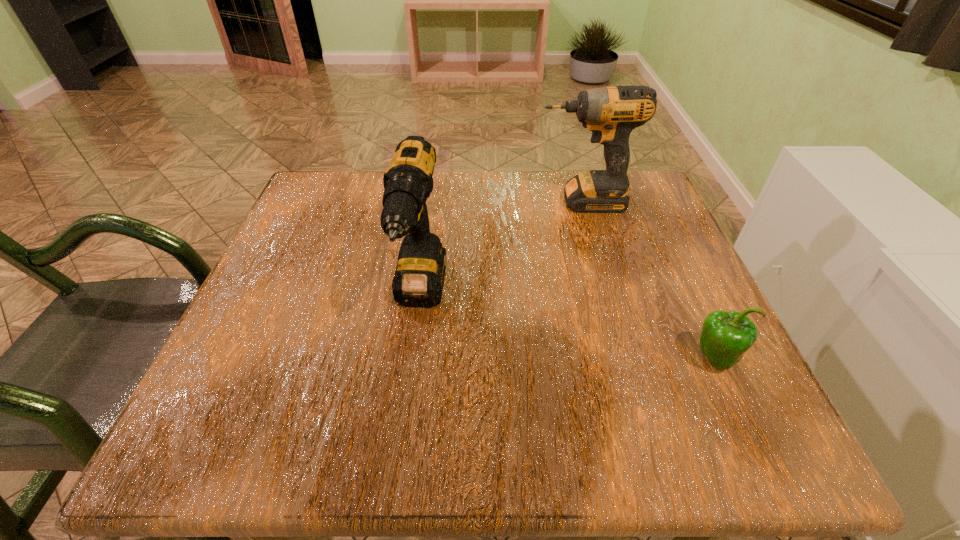
The image size is (960, 540). What are the coordinates of `the nearer drill` in the screenshot? It's located at (418, 281).

Image resolution: width=960 pixels, height=540 pixels. Find the location of `the leftmost object`. the leftmost object is located at coordinates coord(418,281).

I want to click on the right drill, so click(x=611, y=113).

This screenshot has height=540, width=960. Identify the location of the farther drill. (611, 113).

The height and width of the screenshot is (540, 960). In order to click on bell pepper in this screenshot , I will do `click(725, 336)`.

In order to click on free space located 0.050m at the tip of the left drill in this screenshot , I will do `click(410, 374)`.

What are the coordinates of `free space located with the drill bit of the farther drill facing forward` in the screenshot? It's located at (411, 202).

You are a GUI agent. You are given a task and a screenshot of the screen. Output one action in this format:
    pyautogui.click(x=<x>, y=<y>)
    Task: Click on the free space located with the drill bit of the farther drill facing forward
    
    Given the screenshot: What is the action you would take?
    pyautogui.click(x=411, y=202)

Where is `vacant space situated 0.240m with the drill bit of the farther drill facing forward`? vacant space situated 0.240m with the drill bit of the farther drill facing forward is located at coordinates (433, 202).

Locate an element on the screen. This screenshot has width=960, height=540. free location located 0.220m on the left of the shortest object is located at coordinates (556, 358).